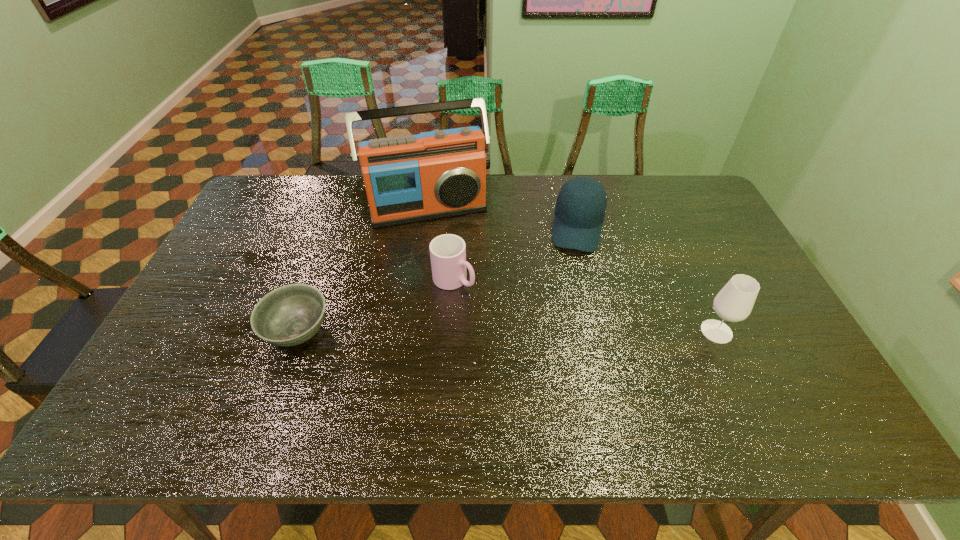
The height and width of the screenshot is (540, 960). Identify the location of free spot on the desktop that is between the bowl and the second tallest object and is positioned on the front-facing side of the baseball cap. (563, 332).

In order to click on vacant spot on the desktop that is between the shortest object and the second tallest object and is positioned with the handle on the side of the second shortest object in this screenshot , I will do `click(531, 332)`.

Find the location of a particular element. Image resolution: width=960 pixels, height=540 pixels. free space on the desktop that is between the bowl and the fourth shortest object and is positioned on the front-facing side of the tallest object is located at coordinates (462, 332).